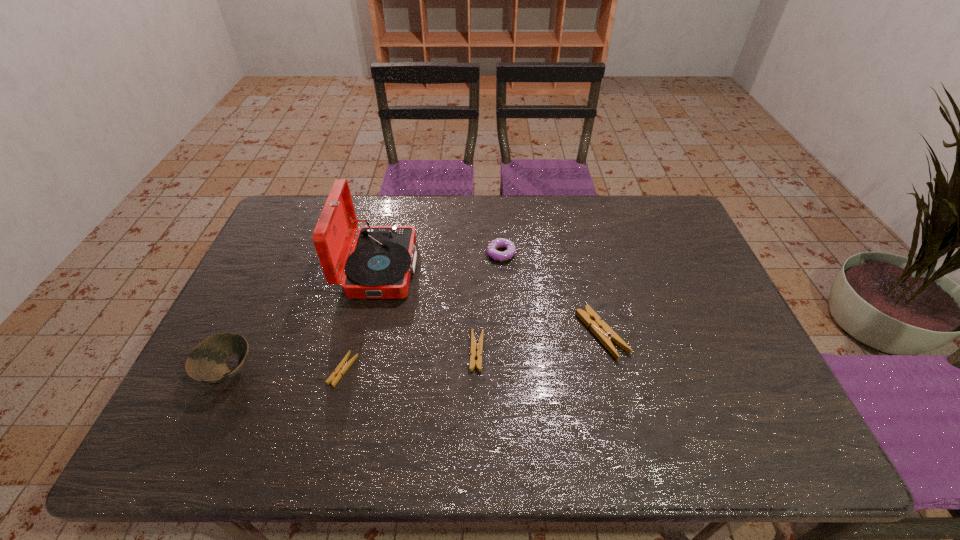
Locate an element on the screen. free space that satisfies the following two spatial constraints: 1. on the back side of the rightmost clothespin; 2. on the right side of the leftmost clothespin is located at coordinates (352, 334).

Where is `vacant area in the image that satisfies the following two spatial constraints: 1. on the back side of the fifth shortest object; 2. on the right side of the fourth shortest object`? The height and width of the screenshot is (540, 960). vacant area in the image that satisfies the following two spatial constraints: 1. on the back side of the fifth shortest object; 2. on the right side of the fourth shortest object is located at coordinates (283, 254).

Where is `free space that satisfies the following two spatial constraints: 1. on the front-facing side of the second shortest object; 2. on the left side of the tallest object`? The height and width of the screenshot is (540, 960). free space that satisfies the following two spatial constraints: 1. on the front-facing side of the second shortest object; 2. on the left side of the tallest object is located at coordinates (360, 352).

Where is `free space in the image that satisfies the following two spatial constraints: 1. on the back side of the rightmost clothespin; 2. on the front-facing side of the phonograph_record`? free space in the image that satisfies the following two spatial constraints: 1. on the back side of the rightmost clothespin; 2. on the front-facing side of the phonograph_record is located at coordinates (586, 268).

What are the coordinates of `free point that satisfies the following two spatial constraints: 1. on the back side of the rightmost clothespin; 2. on the right side of the leftmost clothespin` in the screenshot? It's located at (352, 334).

Where is `blank space that satisfies the following two spatial constraints: 1. on the front-facing side of the phonograph_record; 2. on the front side of the leftmost clothespin`? blank space that satisfies the following two spatial constraints: 1. on the front-facing side of the phonograph_record; 2. on the front side of the leftmost clothespin is located at coordinates (356, 370).